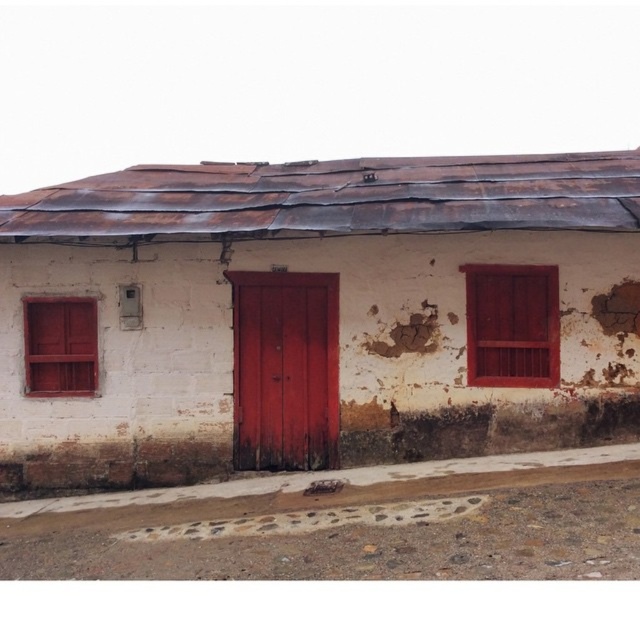
Question: From the image, what is the correct spatial relationship of smooth wooden door at center in relation to wooden at right?

Choices:
 (A) left
 (B) right

Answer: (A)

Question: Estimate the real-world distances between objects in this image. Which object is farther from the smooth wooden door at center?

Choices:
 (A) wooden at right
 (B) smooth glossy wood door at center
 (C) matte wood shutter at left

Answer: (C)

Question: Which object is the farthest from the wooden at right?

Choices:
 (A) matte wood shutter at left
 (B) smooth glossy wood door at center
 (C) smooth wooden door at center

Answer: (A)

Question: Is smooth glossy wood door at center thinner than wooden at right?

Choices:
 (A) no
 (B) yes

Answer: (A)

Question: Is smooth wooden door at center thinner than matte wood shutter at left?

Choices:
 (A) yes
 (B) no

Answer: (B)

Question: Which point is closer to the camera?

Choices:
 (A) (524, 273)
 (B) (362, 429)

Answer: (A)